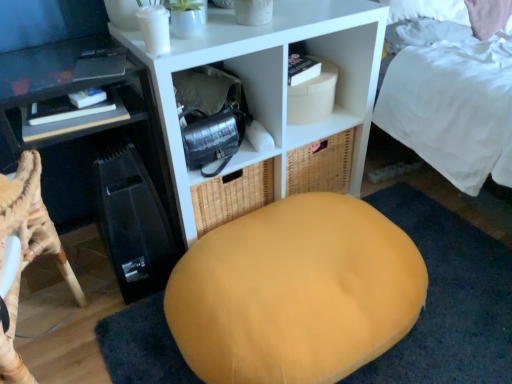
Question: Could you tell me if white matte shelf at center, the first shelf from the right, is facing velvet yellow bean bag at center?

Choices:
 (A) yes
 (B) no

Answer: (A)

Question: Considering the relative positions of white matte shelf at center, which is counted as the 2th shelf, starting from the left, and velvet yellow bean bag at center in the image provided, is white matte shelf at center, which is counted as the 2th shelf, starting from the left, to the right of velvet yellow bean bag at center from the viewer's perspective?

Choices:
 (A) no
 (B) yes

Answer: (A)

Question: Is white matte shelf at center, the first shelf from the right, outside of velvet yellow bean bag at center?

Choices:
 (A) no
 (B) yes

Answer: (B)

Question: From the image's perspective, is white matte shelf at center, the first shelf from the right, below velvet yellow bean bag at center?

Choices:
 (A) yes
 (B) no

Answer: (B)

Question: Is white matte shelf at center, the first shelf from the right, touching velvet yellow bean bag at center?

Choices:
 (A) no
 (B) yes

Answer: (A)

Question: From the image's perspective, is white matte shelf at center, the first shelf from the right, above velvet yellow bean bag at center?

Choices:
 (A) yes
 (B) no

Answer: (A)

Question: Is black plastic shelf at left, the first shelf in the left-to-right sequence, positioned before white matte shelf at center, which is counted as the 2th shelf, starting from the left?

Choices:
 (A) yes
 (B) no

Answer: (B)

Question: Does black plastic shelf at left, the first shelf in the left-to-right sequence, appear on the right side of white matte shelf at center, which is counted as the 2th shelf, starting from the left?

Choices:
 (A) no
 (B) yes

Answer: (A)

Question: From a real-world perspective, is black plastic shelf at left, the first shelf in the left-to-right sequence, below white matte shelf at center, the first shelf from the right?

Choices:
 (A) no
 (B) yes

Answer: (B)

Question: From the image's perspective, is black plastic shelf at left, marked as the 2th shelf in a right-to-left arrangement, below white matte shelf at center, which is counted as the 2th shelf, starting from the left?

Choices:
 (A) yes
 (B) no

Answer: (A)

Question: Is black plastic shelf at left, the first shelf in the left-to-right sequence, placed right next to white matte shelf at center, the first shelf from the right?

Choices:
 (A) yes
 (B) no

Answer: (B)

Question: From the image's perspective, does black plastic shelf at left, marked as the 2th shelf in a right-to-left arrangement, appear higher than white matte shelf at center, which is counted as the 2th shelf, starting from the left?

Choices:
 (A) no
 (B) yes

Answer: (A)

Question: Is white matte shelf at center, which is counted as the 2th shelf, starting from the left, oriented away from matte black desk at left?

Choices:
 (A) no
 (B) yes

Answer: (A)